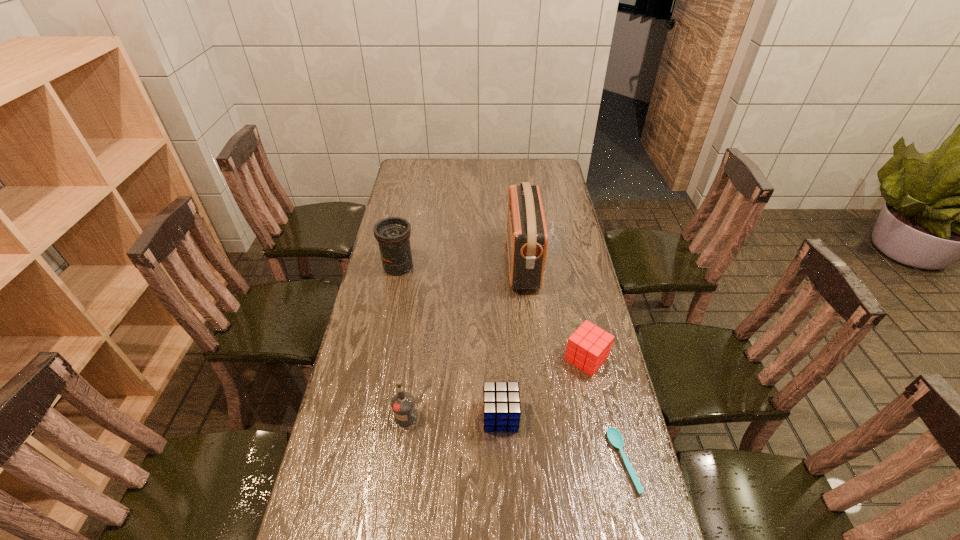
Identify the location of vacant region at the far edge of the desktop. The height and width of the screenshot is (540, 960). 442,181.

Locate an element on the screen. Image resolution: width=960 pixels, height=540 pixels. vacant region at the left edge of the desktop is located at coordinates (408, 184).

What are the coordinates of `vacant space at the right edge of the desktop` in the screenshot? It's located at (564, 220).

In the image, there is a desktop. Identify the location of free space at the far right corner. (553, 167).

This screenshot has height=540, width=960. Identify the location of vacant area between the spoon and the right cube. (605, 409).

At what (x,y) coordinates should I click in order to perform the action: click on vacant point located between the telephoto lens and the third object from left to right. Please return your answer as a coordinate pair (x, y). The height and width of the screenshot is (540, 960). Looking at the image, I should click on (449, 341).

I want to click on vacant area between the shortest object and the leftmost object, so (511, 364).

You are a GUI agent. You are given a task and a screenshot of the screen. Output one action in this format:
    pyautogui.click(x=<x>, y=<y>)
    Task: Click on the unoccupied area between the third object from right to left and the second object from left to right
    
    Given the screenshot: What is the action you would take?
    pyautogui.click(x=465, y=340)

Identify the location of empty location between the right cube and the spoon. (605, 409).

At what (x,y) coordinates should I click in order to perform the action: click on free point between the radio receiver and the third object from left to right. Please return your answer as a coordinate pair (x, y). The width and height of the screenshot is (960, 540). Looking at the image, I should click on (512, 339).